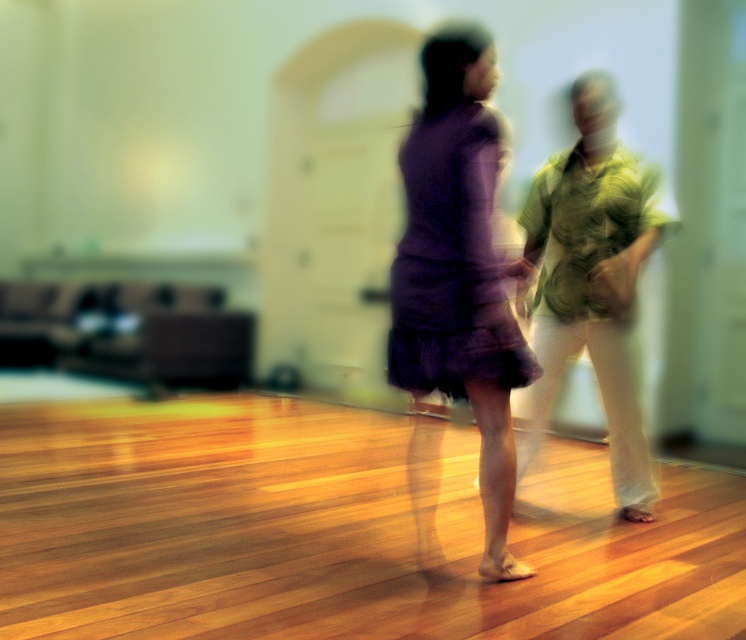
From the picture: You are planning to buy a new dress for an event and want to ensure it will fit in your wardrobe. You currently have a purple matte dress at center and a green textured shirt at right. Which item takes up more space horizontally in your wardrobe?

The green textured shirt at right takes up more space horizontally in the wardrobe because the purple matte dress at center is narrower than the green textured shirt at right.

Based on the image description, if someone wants to walk from the purple matte dress at center to the green textured shirt at right, which direction should they move?

They should move to the right since the purple matte dress at center is to the left of the green textured shirt at right.